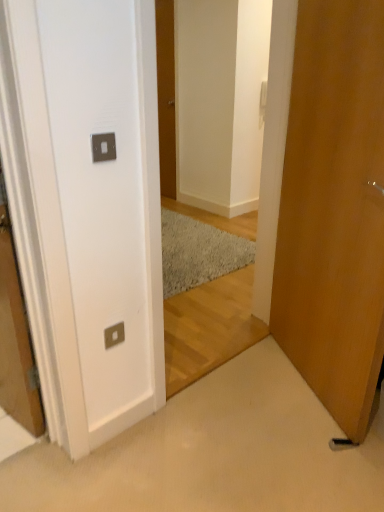
Question: Is wooden door at right, the 1th door positioned from the front, bigger or smaller than satin silver switchplate at lower left?

Choices:
 (A) big
 (B) small

Answer: (A)

Question: Is wooden door at right, the 1th door positioned from the front, in front of or behind satin silver switchplate at lower left in the image?

Choices:
 (A) behind
 (B) front

Answer: (B)

Question: Considering the real-world distances, which object is farthest from the wooden door at center, marked as the 1th door in a left-to-right arrangement?

Choices:
 (A) wooden door at right, arranged as the first door when viewed from the right
 (B) satin silver switchplate at lower left

Answer: (B)

Question: Which is nearer to the wooden door at right, the 1th door positioned from the front?

Choices:
 (A) wooden door at center, which ranks as the first door in top-to-bottom order
 (B) satin silver switchplate at lower left

Answer: (B)